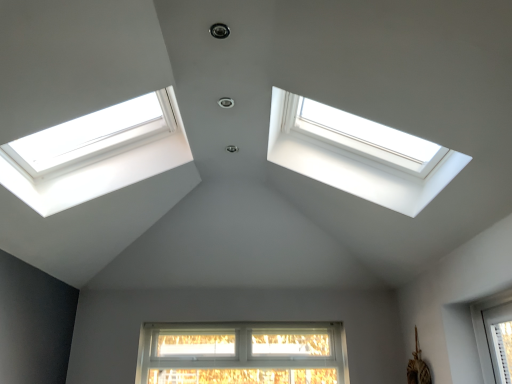
Find the location of a particular element. The image size is (512, 384). white plastic window at upper left is located at coordinates (96, 153).

The width and height of the screenshot is (512, 384). What do you see at coordinates (96, 153) in the screenshot?
I see `white plastic window at upper left` at bounding box center [96, 153].

At what (x,y) coordinates should I click in order to perform the action: click on white plastic window at upper left. Please return your answer as a coordinate pair (x, y). Looking at the image, I should click on (96, 153).